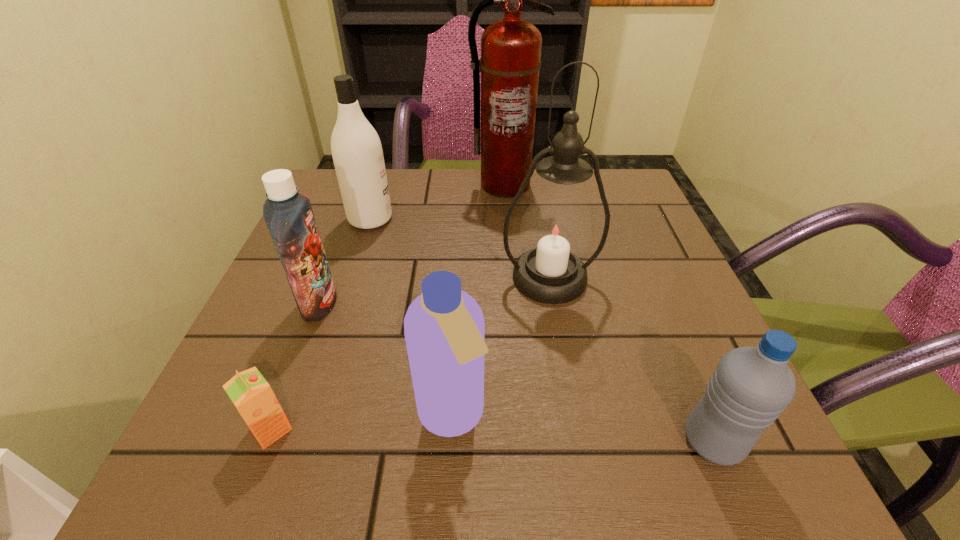
Where is `fire extinguisher`? fire extinguisher is located at coordinates (510, 62).

Where is `oil lamp`? Image resolution: width=960 pixels, height=540 pixels. oil lamp is located at coordinates (556, 230).

Image resolution: width=960 pixels, height=540 pixels. Identify the location of the third tallest object. (357, 152).

You are a GUI agent. You are given a task and a screenshot of the screen. Output one action in this format:
    pyautogui.click(x=<x>, y=<y>)
    Task: Click on the tallest shampoo
    This screenshot has height=540, width=960.
    Given the screenshot: What is the action you would take?
    pyautogui.click(x=357, y=152)

Find the location of a particular element. the second nearest shampoo is located at coordinates 289,216.

You are a GUI agent. You are given a task and a screenshot of the screen. Output one action in this format:
    pyautogui.click(x=<x>, y=<y>)
    Task: Click on the nearest shampoo
    
    Given the screenshot: What is the action you would take?
    pyautogui.click(x=444, y=328)

Locate an element on the screen. This screenshot has height=540, width=960. the sixth tallest object is located at coordinates (751, 386).

Image resolution: width=960 pixels, height=540 pixels. Find the location of `water bottle`. water bottle is located at coordinates (751, 386).

Identify the location of the shortest object. (251, 394).

Locate an element on the screen. The height and width of the screenshot is (540, 960). vacant area located on the nozzle side of the farthest object is located at coordinates (507, 215).